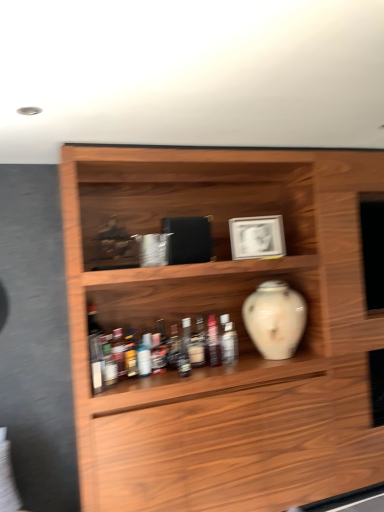
Question: Should I look upward or downward to see white glossy vase at center?

Choices:
 (A) down
 (B) up

Answer: (A)

Question: From the image's perspective, is translucent plastic bottle at center, acting as the 2th bottle starting from the back, beneath translucent plastic bottles at lower center, which is the third bottle from back to front?

Choices:
 (A) no
 (B) yes

Answer: (A)

Question: Is translucent plastic bottle at center, the third bottle when ordered from left to right, facing towards translucent plastic bottles at lower center, which is the third bottle from back to front?

Choices:
 (A) yes
 (B) no

Answer: (B)

Question: Are translucent plastic bottle at center, acting as the first bottle starting from the right, and translucent plastic bottles at lower center, which is the third bottle from back to front, far apart?

Choices:
 (A) yes
 (B) no

Answer: (B)

Question: From the image's perspective, is translucent plastic bottle at center, acting as the 2th bottle starting from the back, on top of translucent plastic bottles at lower center, which is counted as the 1th bottle, starting from the front?

Choices:
 (A) yes
 (B) no

Answer: (A)

Question: Does translucent plastic bottle at center, acting as the first bottle starting from the right, have a greater width compared to translucent plastic bottles at lower center, placed as the third bottle when sorted from right to left?

Choices:
 (A) yes
 (B) no

Answer: (B)

Question: Is translucent plastic bottle at center, acting as the first bottle starting from the right, taller than translucent plastic bottles at lower center, which is the third bottle from back to front?

Choices:
 (A) no
 (B) yes

Answer: (A)

Question: Is white glossy vase at center facing towards translucent plastic bottles at lower center, placed as the 1th bottle when sorted from left to right?

Choices:
 (A) no
 (B) yes

Answer: (A)

Question: From a real-world perspective, is white glossy vase at center positioned under translucent plastic bottles at lower center, placed as the third bottle when sorted from right to left, based on gravity?

Choices:
 (A) no
 (B) yes

Answer: (A)

Question: Is white glossy vase at center wider than translucent plastic bottles at lower center, placed as the 1th bottle when sorted from left to right?

Choices:
 (A) no
 (B) yes

Answer: (B)

Question: Are white glossy vase at center and translucent plastic bottles at lower center, placed as the 1th bottle when sorted from left to right, located far from each other?

Choices:
 (A) yes
 (B) no

Answer: (B)

Question: Is white glossy vase at center shorter than translucent plastic bottles at lower center, placed as the 1th bottle when sorted from left to right?

Choices:
 (A) no
 (B) yes

Answer: (A)

Question: Can you confirm if white glossy vase at center is smaller than translucent plastic bottles at lower center, which is the third bottle from back to front?

Choices:
 (A) yes
 (B) no

Answer: (B)

Question: Is translucent plastic bottle at center, acting as the 2th bottle starting from the back, completely or partially inside translucent plastic bottles at lower center, placed as the 1th bottle when sorted from left to right?

Choices:
 (A) no
 (B) yes

Answer: (A)